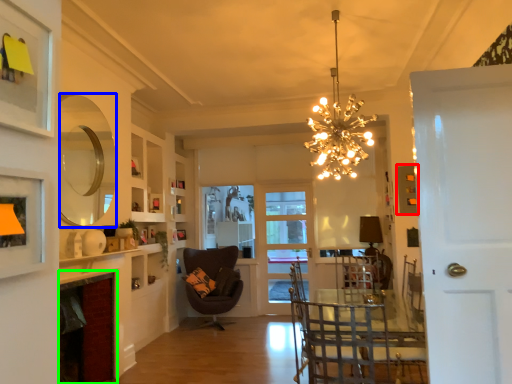
Question: Based on their relative distances, which object is farther from picture frame (highlighted by a red box)? Choose from mirror (highlighted by a blue box) and fireplace (highlighted by a green box).

Choices:
 (A) mirror
 (B) fireplace

Answer: (B)